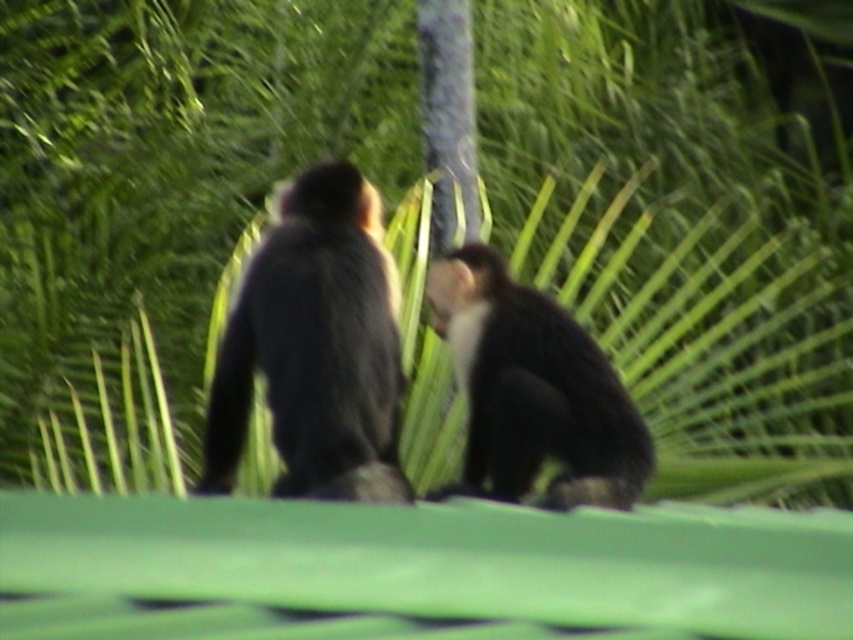
Question: Which point is closer to the camera taking this photo?

Choices:
 (A) (608, 436)
 (B) (349, 451)

Answer: (B)

Question: Does dark fur monkey at center lie in front of black furry monkey at center?

Choices:
 (A) yes
 (B) no

Answer: (A)

Question: Which of the following is the closest to the observer?

Choices:
 (A) black fur tail at left
 (B) black furry monkey at center

Answer: (B)

Question: Where is black furry monkey at center located in relation to black fur tail at left in the image?

Choices:
 (A) left
 (B) right

Answer: (B)

Question: Which is farther from the black fur tail at left?

Choices:
 (A) black furry monkey at center
 (B) dark fur monkey at center

Answer: (A)

Question: Can you confirm if dark fur monkey at center is wider than black fur tail at left?

Choices:
 (A) no
 (B) yes

Answer: (B)